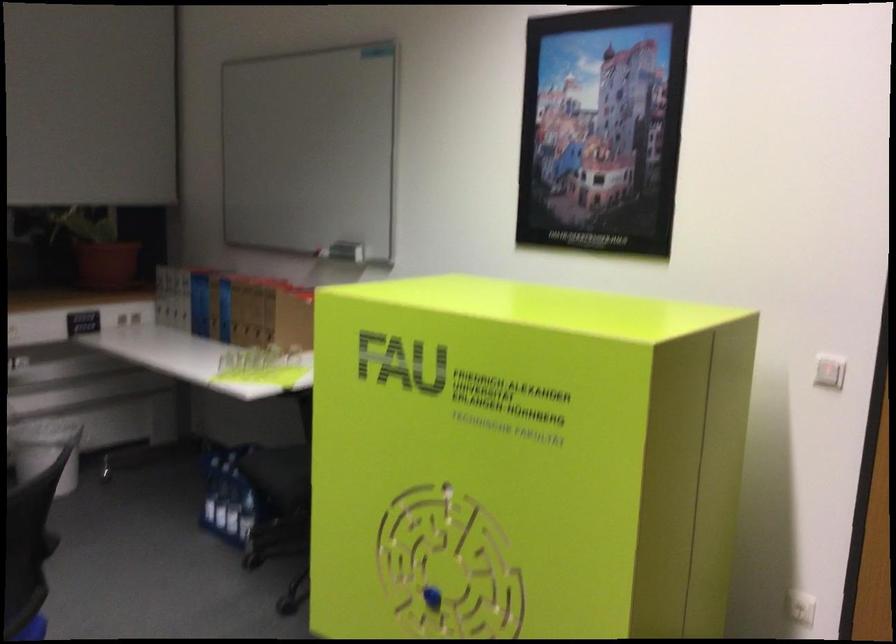
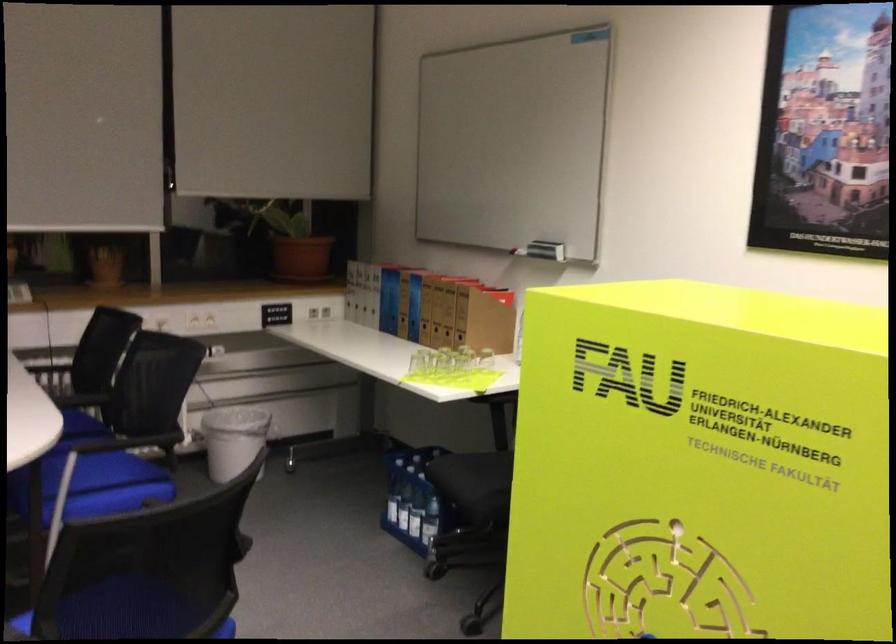
In a continuous first-person perspective shot, in which direction is the camera moving?

The cameraman walked toward left, forward.